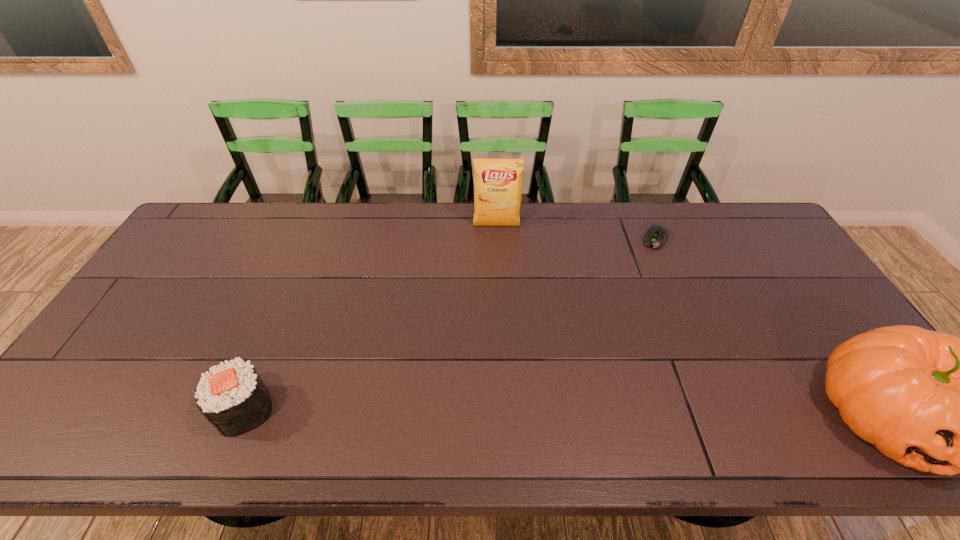
At what (x,y) coordinates should I click in order to perform the action: click on vacant point at the far right corner. Please return your answer as a coordinate pair (x, y). This screenshot has height=540, width=960. Looking at the image, I should click on (764, 226).

This screenshot has height=540, width=960. Find the location of `free space between the computer mouse and the second object from left to right`. free space between the computer mouse and the second object from left to right is located at coordinates (576, 232).

In order to click on vacant space in between the crisp (potato chip) and the second object from right to left in this screenshot , I will do `click(576, 232)`.

The width and height of the screenshot is (960, 540). In order to click on empty location between the crisp (potato chip) and the sushi in this screenshot , I will do (x=371, y=318).

Image resolution: width=960 pixels, height=540 pixels. Identify the location of free space between the sushi and the crisp (potato chip). (371, 318).

I want to click on vacant space that's between the leftmost object and the third object from left to right, so click(x=450, y=324).

At what (x,y) coordinates should I click in order to perform the action: click on free area in between the leftmost object and the shortest object. Please return your answer as a coordinate pair (x, y). The width and height of the screenshot is (960, 540). Looking at the image, I should click on (450, 324).

Identify which object is the second nearest to the rightmost object. Please provide its 2D coordinates. Your answer should be formatted as a tuple, i.e. [(x, y)], where the tuple contains the x and y coordinates of a point satisfying the conditions above.

[(498, 181)]

Identify which object is the third nearest to the computer mouse. Please provide its 2D coordinates. Your answer should be formatted as a tuple, i.e. [(x, y)], where the tuple contains the x and y coordinates of a point satisfying the conditions above.

[(233, 398)]

Identify the location of free space that satisfies the following two spatial constraints: 1. on the back side of the second shortest object; 2. on the left side of the computer mouse. This screenshot has width=960, height=540. (315, 238).